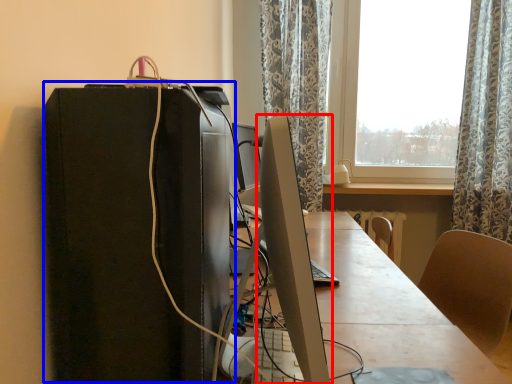
Question: Which object appears farthest to the camera in this image, computer monitor (highlighted by a red box) or computer tower (highlighted by a blue box)?

Choices:
 (A) computer monitor
 (B) computer tower

Answer: (B)